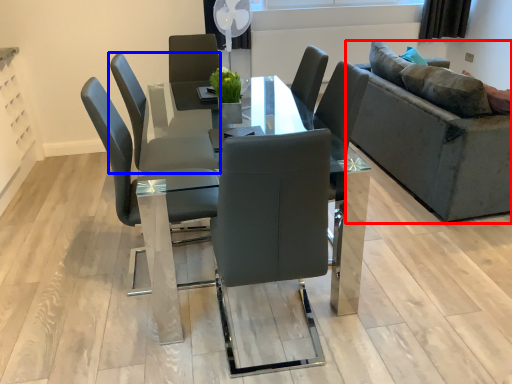
Question: Which object is further to the camera taking this photo, studio couch (highlighted by a red box) or chair (highlighted by a blue box)?

Choices:
 (A) studio couch
 (B) chair

Answer: (A)